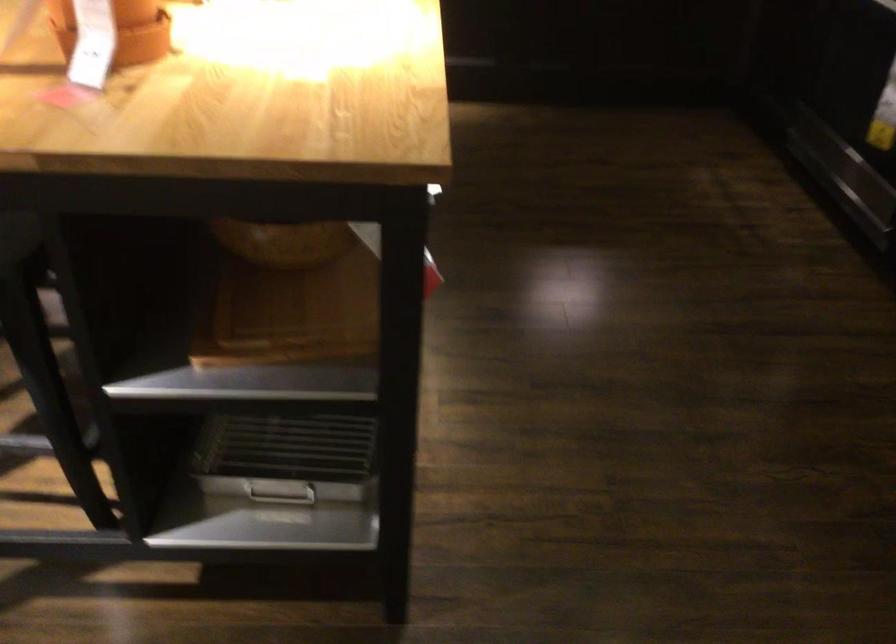
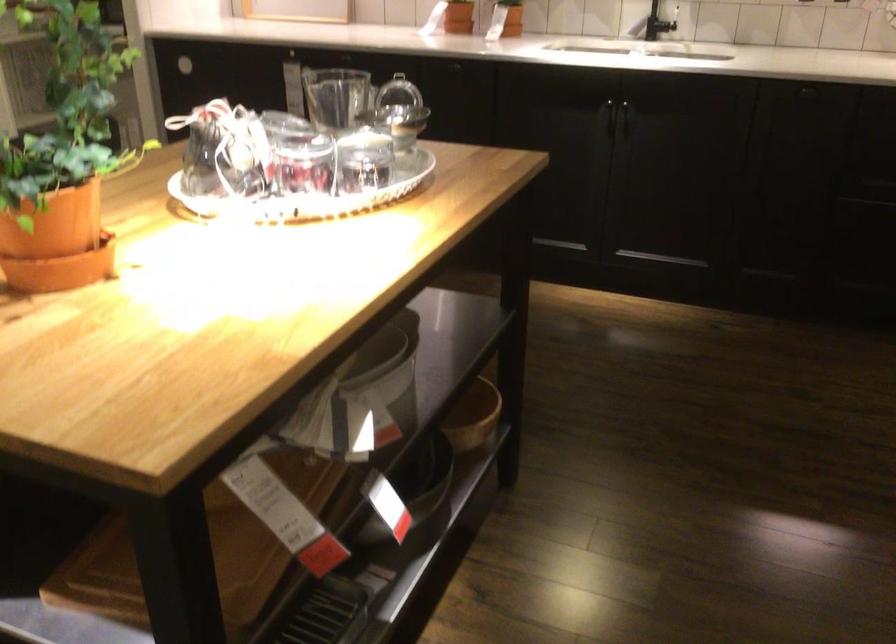
The point at (354,129) is marked in the first image. Where is the corresponding point in the second image?

(135, 406)